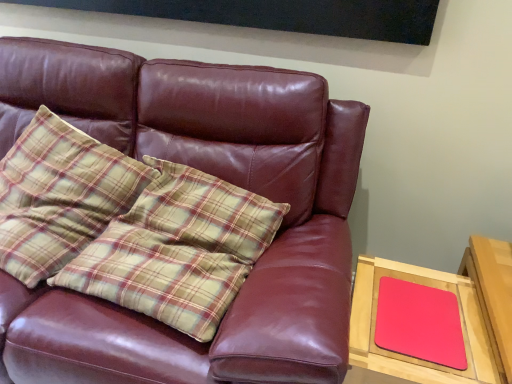
Question: Is matte pink mousepad at right at the back of matte pink mousepad at right?

Choices:
 (A) yes
 (B) no

Answer: (A)

Question: From the image's perspective, is matte pink mousepad at right above matte pink mousepad at right?

Choices:
 (A) yes
 (B) no

Answer: (A)

Question: Is matte pink mousepad at right shorter than matte pink mousepad at right?

Choices:
 (A) yes
 (B) no

Answer: (A)

Question: Considering the relative sizes of matte pink mousepad at right and matte pink mousepad at right in the image provided, is matte pink mousepad at right bigger than matte pink mousepad at right?

Choices:
 (A) yes
 (B) no

Answer: (B)

Question: Is matte pink mousepad at right next to matte pink mousepad at right and touching it?

Choices:
 (A) no
 (B) yes

Answer: (B)

Question: Does point (350, 200) appear closer or farther from the camera than point (394, 306)?

Choices:
 (A) closer
 (B) farther

Answer: (B)

Question: From a real-world perspective, is matte leather couch at center above or below matte pink mousepad at right?

Choices:
 (A) above
 (B) below

Answer: (A)

Question: Relative to matte pink mousepad at right, is matte leather couch at center in front or behind?

Choices:
 (A) behind
 (B) front

Answer: (B)

Question: Is matte leather couch at center inside the boundaries of matte pink mousepad at right, or outside?

Choices:
 (A) inside
 (B) outside

Answer: (B)

Question: Based on their sizes in the image, would you say matte pink mousepad at right is bigger or smaller than plaid fabric pillow at left?

Choices:
 (A) big
 (B) small

Answer: (B)

Question: Considering the positions of matte pink mousepad at right and plaid fabric pillow at left in the image, is matte pink mousepad at right wider or thinner than plaid fabric pillow at left?

Choices:
 (A) thin
 (B) wide

Answer: (A)

Question: From the image's perspective, is matte pink mousepad at right positioned above or below plaid fabric pillow at left?

Choices:
 (A) below
 (B) above

Answer: (A)

Question: In terms of height, does matte pink mousepad at right look taller or shorter compared to plaid fabric pillow at left?

Choices:
 (A) tall
 (B) short

Answer: (B)

Question: Is matte leather couch at center in front of or behind plaid fabric pillow at left in the image?

Choices:
 (A) front
 (B) behind

Answer: (A)

Question: Is point (348, 170) positioned closer to the camera than point (65, 160)?

Choices:
 (A) closer
 (B) farther

Answer: (A)